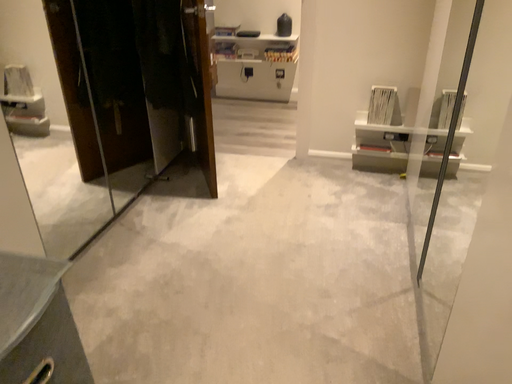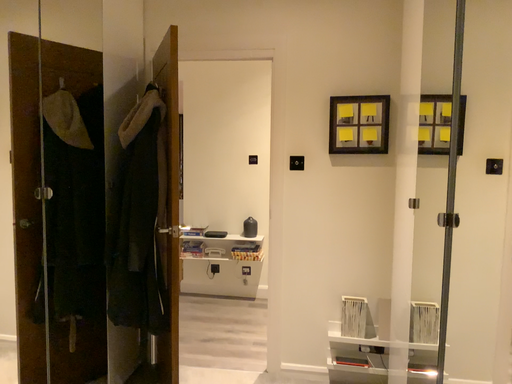
Question: Which way did the camera rotate in the video?

Choices:
 (A) rotated downward
 (B) rotated upward

Answer: (B)